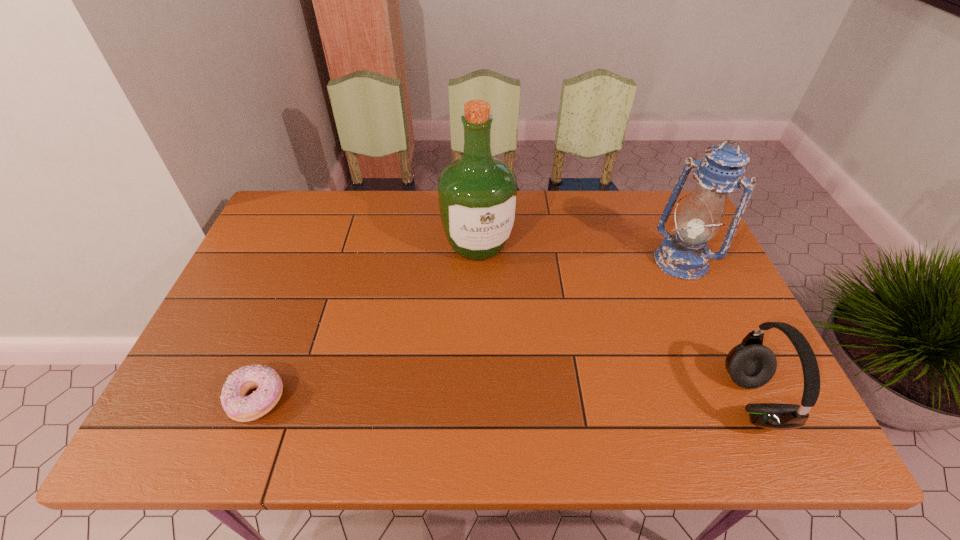
You are a GUI agent. You are given a task and a screenshot of the screen. Output one action in this format:
    pyautogui.click(x=<x>, y=<y>)
    Task: Click on the vacant area between the third tallest object and the liquor
    The image size is (960, 540).
    Given the screenshot: What is the action you would take?
    pyautogui.click(x=615, y=322)

Where is `vacant area that lies between the second tallest object and the headset`? This screenshot has height=540, width=960. vacant area that lies between the second tallest object and the headset is located at coordinates (716, 330).

Where is `free area in between the leftmost object and the third tallest object`? This screenshot has height=540, width=960. free area in between the leftmost object and the third tallest object is located at coordinates (505, 400).

Identify the location of empty space that is in between the liquor and the second tallest object. (580, 253).

Where is `empty location between the liquor and the headset`? The image size is (960, 540). empty location between the liquor and the headset is located at coordinates (615, 322).

At what (x,y) coordinates should I click in order to perform the action: click on vacant space that's between the shortest object and the liquor. Please return your answer as a coordinate pair (x, y). Looking at the image, I should click on (368, 322).

Find the location of a particular element. The height and width of the screenshot is (540, 960). free area in between the doughnut and the liquor is located at coordinates (368, 322).

Where is `vacant area that lies between the headset and the leftmost object`? vacant area that lies between the headset and the leftmost object is located at coordinates (505, 400).

The image size is (960, 540). I want to click on unoccupied position between the lantern and the headset, so point(716,330).

Point out which object is positioned as the nearest to the liquor. Please provide its 2D coordinates. Your answer should be formatted as a tuple, i.e. [(x, y)], where the tuple contains the x and y coordinates of a point satisfying the conditions above.

[(685, 255)]